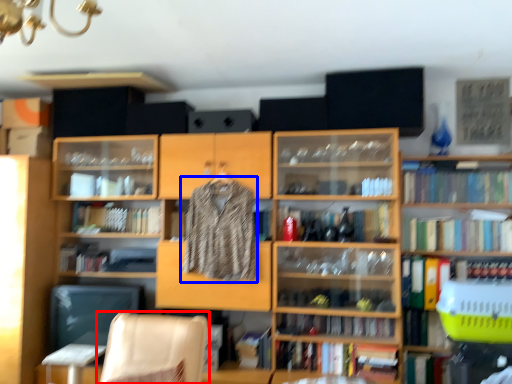
Question: Which point is closer to the camera, chair (highlighted by a red box) or clothing (highlighted by a blue box)?

Choices:
 (A) chair
 (B) clothing

Answer: (A)